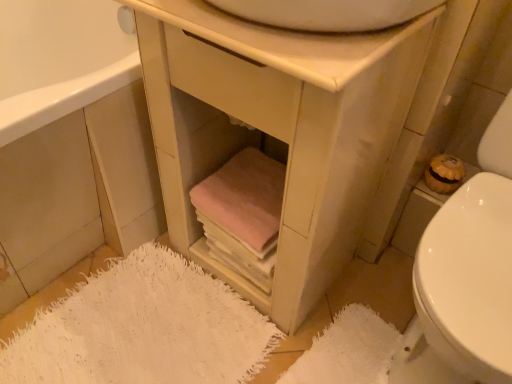
At what (x,y) coordinates should I click in order to perform the action: click on free point below white fuzzy bath mat at lower left, which is counted as the second bath mat, starting from the right (from a real-world perspective). Please return your answer as a coordinate pair (x, y). Image resolution: width=512 pixels, height=384 pixels. Looking at the image, I should click on (148, 336).